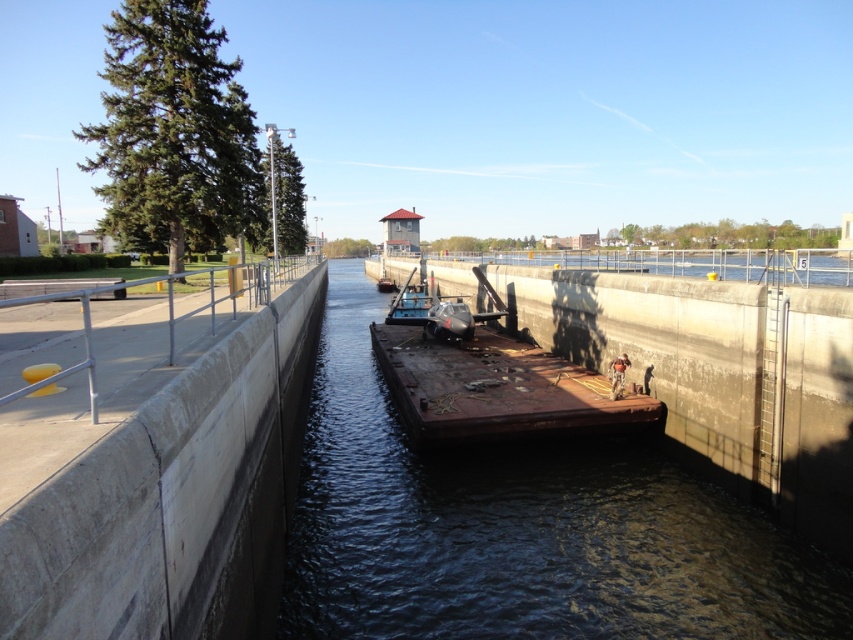
Which is above, rusty metal water at center or rusty metal barge at center?

rusty metal barge at center is higher up.

Locate an element on the screen. The width and height of the screenshot is (853, 640). rusty metal water at center is located at coordinates (520, 531).

Does point (426, 586) come closer to viewer compared to point (531, 426)?

Yes, it is in front of point (531, 426).

Identify the location of rusty metal water at center. This screenshot has height=640, width=853. (520, 531).